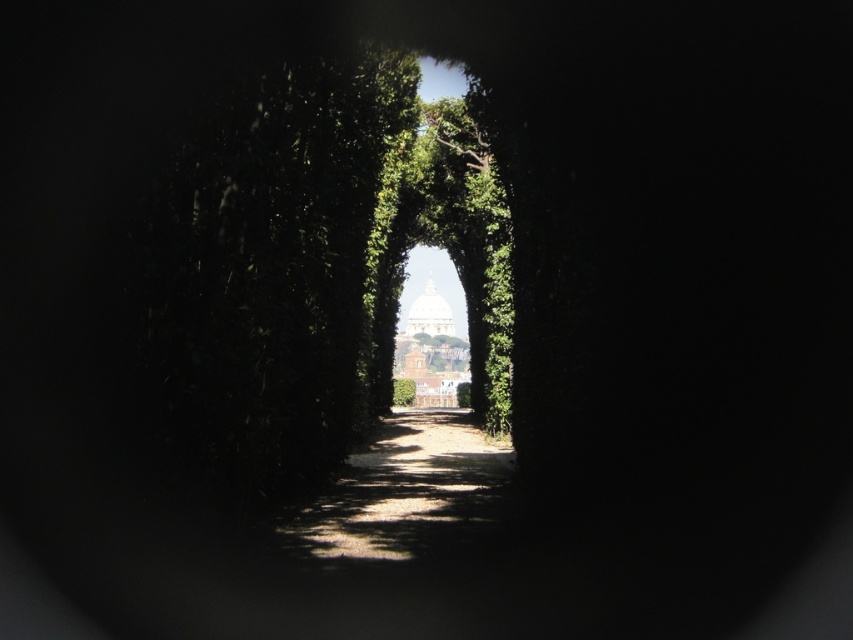
You are planning to walk along the dirt path at center and want to reach the green leafy hedge at center. Given that your walking speed is 3 feet per second, how many seconds will it take you to reach the hedge?

The dirt path at center and green leafy hedge at center are 254.58 feet apart from each other. At a speed of 3 feet per second, it would take 254.58 divided by 3, which is approximately 84.86 seconds to reach the green leafy hedge at center.

You are standing at the entrance of the tunnel formed by the greenery and looking towards the domed structure. There are two points marked on the ground ahead of you. The first point is at coordinates point (399, 410) and the second is at point (407, 403). Which of these two points is closer to you as you face the tunnel?

Point (399, 410) is closer to you because it is in front of point (407, 403).